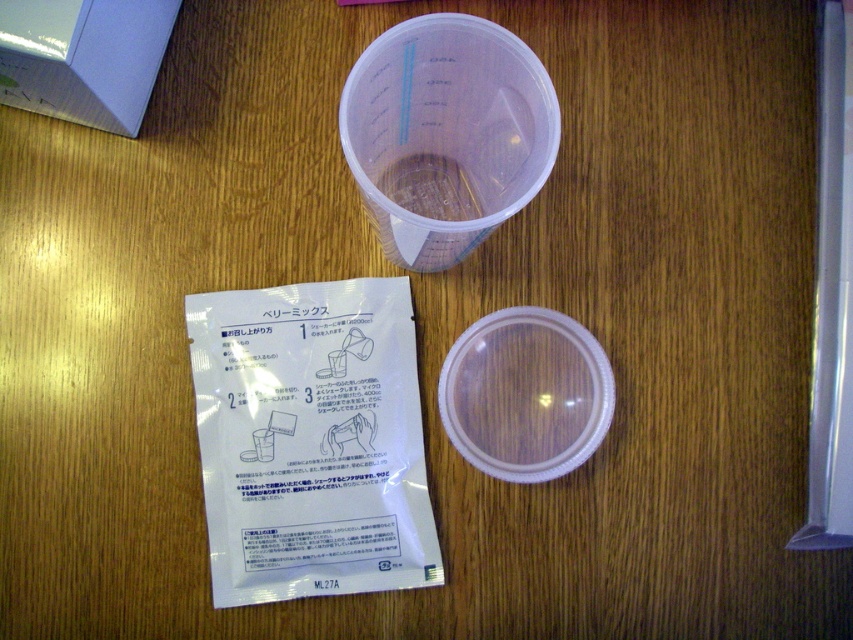
You are a delivery robot that needs to place a package on the table. The package must be placed exactly 70 centimeters away from the camera. You see the white matte packet at lower left on the table. Can you use its position to determine if you can place the package at the required distance?

The white matte packet at lower left is 72.61 centimeters from the camera, so placing the package exactly 70 centimeters away is possible since there is space between the packet and the camera. Adjust the placement slightly closer to the camera than the white matte packet at lower left.

In the scene shown: You are organizing items on a wooden table for a science experiment. You have a white matte packet at lower left and a matte white box at upper left. According to their positions, which item is closer to the edge of the table?

The white matte packet at lower left is closer to the edge of the table because it is positioned below the matte white box at upper left, meaning it is lower on the table and thus nearer to the edge.

You are organizing items on a table and need to place the white matte packet at lower left and the matte white box at upper left side by side. Which one should you place first to ensure they fit properly?

The white matte packet at lower left is wider than the matte white box at upper left. Place the wider white matte packet at lower left first to accommodate its larger width before positioning the narrower matte white box at upper left.